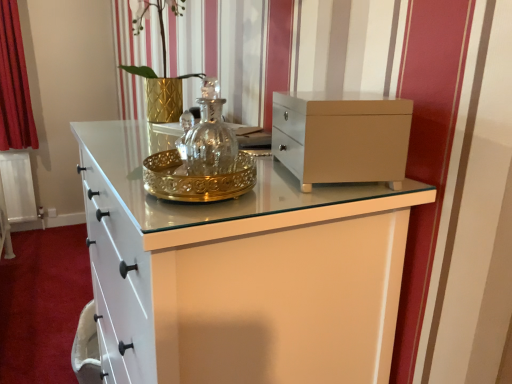
Question: Considering the relative positions of matte beige chest at upper center and red velvet curtain at left in the image provided, is matte beige chest at upper center to the left or to the right of red velvet curtain at left?

Choices:
 (A) right
 (B) left

Answer: (A)

Question: Considering the positions of matte beige chest at upper center and red velvet curtain at left in the image, is matte beige chest at upper center taller or shorter than red velvet curtain at left?

Choices:
 (A) short
 (B) tall

Answer: (A)

Question: From a real-world perspective, is matte beige chest at upper center above or below red velvet curtain at left?

Choices:
 (A) above
 (B) below

Answer: (A)

Question: Is red velvet curtain at left taller or shorter than matte beige chest at upper center?

Choices:
 (A) short
 (B) tall

Answer: (B)

Question: Choose the correct answer: Is red velvet curtain at left inside matte beige chest at upper center or outside it?

Choices:
 (A) outside
 (B) inside

Answer: (A)

Question: Is red velvet curtain at left to the left or to the right of matte beige chest at upper center in the image?

Choices:
 (A) right
 (B) left

Answer: (B)

Question: From the image's perspective, relative to matte beige chest at upper center, is red velvet curtain at left above or below?

Choices:
 (A) above
 (B) below

Answer: (A)